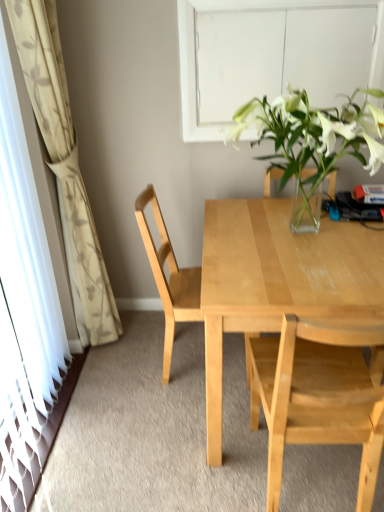
The width and height of the screenshot is (384, 512). Find the location of `vacant space that is to the left of light wood chair at center, marked as the first chair in a back-to-front arrangement`. vacant space that is to the left of light wood chair at center, marked as the first chair in a back-to-front arrangement is located at coordinates (x=131, y=370).